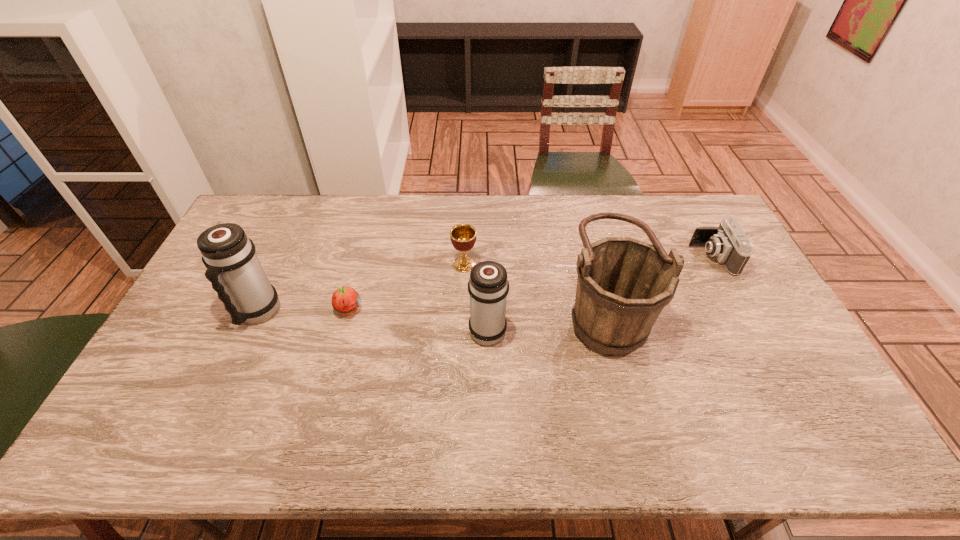
Where is `free space located 0.310m on the side with the handle of the shorter thermos bottle`? The width and height of the screenshot is (960, 540). free space located 0.310m on the side with the handle of the shorter thermos bottle is located at coordinates (487, 244).

This screenshot has width=960, height=540. I want to click on vacant space situated on the side with the handle of the shorter thermos bottle, so click(486, 237).

I want to click on free space located on the side with the handle of the shorter thermos bottle, so click(487, 284).

Find the location of a particular element. vacant space positioned 0.310m on the handle side of the bucket is located at coordinates (459, 311).

At what (x,y) coordinates should I click in order to perform the action: click on vacant space situated 0.200m on the handle side of the bucket. Please return your answer as a coordinate pair (x, y). This screenshot has width=960, height=540. Looking at the image, I should click on (495, 311).

Locate an element on the screen. The image size is (960, 540). vacant space located 0.080m on the handle side of the bucket is located at coordinates (535, 311).

I want to click on vacant area located at the front of the rightmost object with an open lens cover, so click(627, 258).

Image resolution: width=960 pixels, height=540 pixels. What are the coordinates of `vacant space positioned 0.180m at the front of the rightmost object with an open lens cover` in the screenshot? It's located at [x=639, y=258].

The width and height of the screenshot is (960, 540). What are the coordinates of `free space located at the front of the rightmost object with an open lens cover` in the screenshot? It's located at (624, 258).

At what (x,y) coordinates should I click in order to perform the action: click on vacant space located 0.050m on the front of the second object from left to right. Please return your answer as a coordinate pair (x, y). This screenshot has height=540, width=960. Looking at the image, I should click on (342, 336).